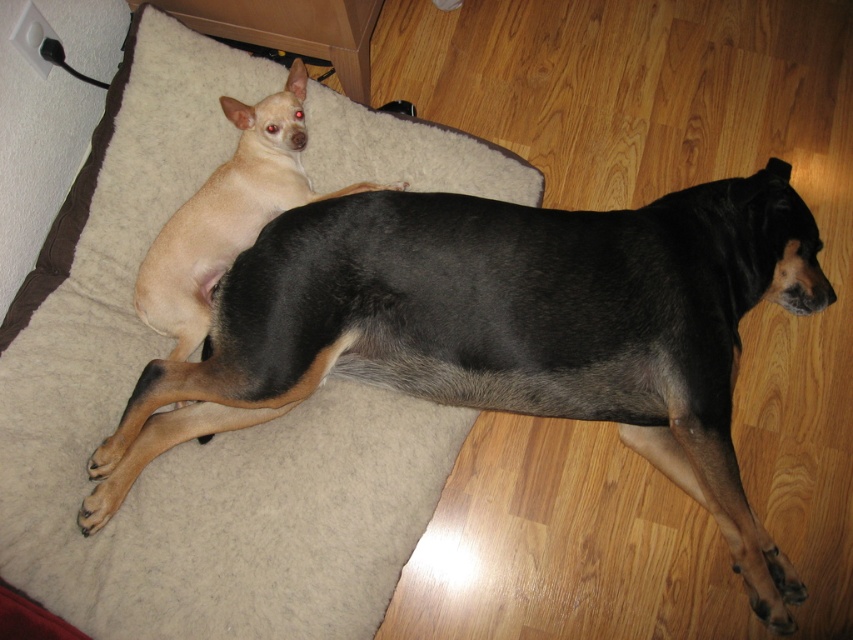
Question: Which point appears closest to the camera in this image?

Choices:
 (A) (662, 285)
 (B) (155, 506)
 (C) (221, 218)

Answer: (B)

Question: Which point is farther to the camera?

Choices:
 (A) beige fleece dog bed at upper left
 (B) light beige fur at upper left

Answer: (B)

Question: Is beige fleece dog bed at upper left to the left of light beige fur at upper left from the viewer's perspective?

Choices:
 (A) no
 (B) yes

Answer: (B)

Question: Which point is closer to the camera?

Choices:
 (A) (761, 193)
 (B) (189, 269)
 (C) (158, 212)

Answer: (B)

Question: Does beige fleece dog bed at upper left appear on the right side of light beige fur at upper left?

Choices:
 (A) yes
 (B) no

Answer: (B)

Question: Is beige fleece dog bed at upper left positioned before black fur dog at upper center?

Choices:
 (A) yes
 (B) no

Answer: (A)